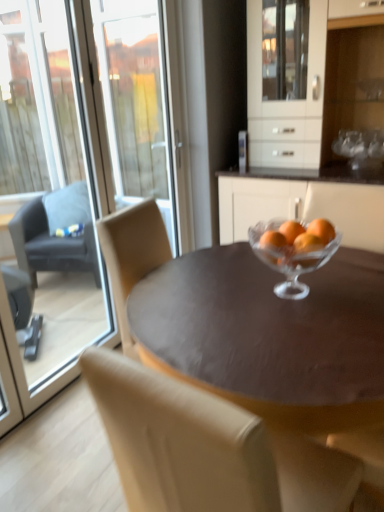
Measure the distance between point (317, 236) and camera.

Point (317, 236) is 1.36 meters from camera.

In order to face matte brown table at center, should I rotate leftwards or rightwards?

To face it directly, rotate right by 10.409 degrees.

Where is `clear glass bowl at center`? The height and width of the screenshot is (512, 384). clear glass bowl at center is located at coordinates (290, 259).

What do you see at coordinates (56, 179) in the screenshot? This screenshot has height=512, width=384. I see `transparent glass screen door at upper left` at bounding box center [56, 179].

Identify the location of orangesmooth glassbowl at center. (322, 230).

Considering the relative positions of orangesmooth glassbowl at center and matte brown table at center in the image provided, is orangesmooth glassbowl at center behind matte brown table at center?

Yes, orangesmooth glassbowl at center is further from the camera.

Which of these two, orangesmooth glassbowl at center or matte brown table at center, is smaller?

With smaller size is orangesmooth glassbowl at center.

Is orangesmooth glassbowl at center taller or shorter than matte brown table at center?

orangesmooth glassbowl at center is shorter than matte brown table at center.

Is beige leather chair at center, the second chair positioned from the top, oriented towards transparent glass screen door at upper left?

No, beige leather chair at center, the second chair positioned from the top, is not oriented towards transparent glass screen door at upper left.

Does beige leather chair at center, arranged as the 1th chair when ordered from the bottom, lie in front of transparent glass screen door at upper left?

Yes, beige leather chair at center, arranged as the 1th chair when ordered from the bottom, is closer to the viewer.

Looking at the image, does matte brown table at center seem bigger or smaller compared to dark gray fabric chair at left, the 2th chair positioned from the front?

In the image, matte brown table at center appears to be larger than dark gray fabric chair at left, the 2th chair positioned from the front.

Between matte brown table at center and dark gray fabric chair at left, which is counted as the 2th chair, starting from the right, which one has smaller width?

With smaller width is dark gray fabric chair at left, which is counted as the 2th chair, starting from the right.

Which is closer, (176, 364) or (62, 262)?

Point (176, 364) appears to be closer to the viewer than point (62, 262).

Could you tell me if matte brown table at center is turned towards dark gray fabric chair at left, which is counted as the 2th chair, starting from the right?

No.

From a real-world perspective, who is located higher, orangesmooth glassbowl at center or dark gray fabric chair at left, which ranks as the 2th chair in bottom-to-top order?

orangesmooth glassbowl at center is physically above.

Is orangesmooth glassbowl at center outside of dark gray fabric chair at left, which is counted as the 2th chair, starting from the right?

orangesmooth glassbowl at center lies outside dark gray fabric chair at left, which is counted as the 2th chair, starting from the right,'s area.

Does orangesmooth glassbowl at center come behind dark gray fabric chair at left, the 1th chair from the top?

No, the depth of orangesmooth glassbowl at center is less than that of dark gray fabric chair at left, the 1th chair from the top.

Could you measure the distance between matte brown table at center and beige leather chair at center, the second chair from the back?

matte brown table at center is 19.53 inches away from beige leather chair at center, the second chair from the back.

Considering the relative sizes of matte brown table at center and beige leather chair at center, marked as the second chair in a left-to-right arrangement, in the image provided, is matte brown table at center shorter than beige leather chair at center, marked as the second chair in a left-to-right arrangement,?

Yes, matte brown table at center is shorter than beige leather chair at center, marked as the second chair in a left-to-right arrangement.

From a real-world perspective, is matte brown table at center on beige leather chair at center, marked as the second chair in a left-to-right arrangement?

No, from a real-world perspective, matte brown table at center is not on top of beige leather chair at center, marked as the second chair in a left-to-right arrangement.

Between matte brown table at center and beige leather chair at center, arranged as the 1th chair when ordered from the bottom, which one appears on the left side from the viewer's perspective?

Positioned to the left is beige leather chair at center, arranged as the 1th chair when ordered from the bottom.

From a real-world perspective, is clear glass bowl at center above or below transparent glass screen door at upper left?

In terms of real-world spatial position, clear glass bowl at center is below transparent glass screen door at upper left.

From the picture: From the image's perspective, is clear glass bowl at center positioned above or below transparent glass screen door at upper left?

Clearly, from the image's perspective, clear glass bowl at center is below transparent glass screen door at upper left.

Is clear glass bowl at center wider than transparent glass screen door at upper left?

Yes, clear glass bowl at center is wider than transparent glass screen door at upper left.

Is clear glass bowl at center thinner than beige leather chair at center, the second chair positioned from the top?

Correct, the width of clear glass bowl at center is less than that of beige leather chair at center, the second chair positioned from the top.

Based on the photo, can you tell me how much clear glass bowl at center and beige leather chair at center, arranged as the 1th chair when ordered from the bottom, differ in facing direction?

There is a 82.8-degree angle between the facing directions of clear glass bowl at center and beige leather chair at center, arranged as the 1th chair when ordered from the bottom.

From the image's perspective, would you say clear glass bowl at center is shown under beige leather chair at center, the 1th chair viewed from the front?

No.

Looking at the image, does clear glass bowl at center seem bigger or smaller compared to beige leather chair at center, the second chair from the back?

clear glass bowl at center is smaller than beige leather chair at center, the second chair from the back.

Locate an element on the screen. The height and width of the screenshot is (512, 384). coffee table that is in front of the orangesmooth glassbowl at center is located at coordinates (270, 335).

Locate an element on the screen. Image resolution: width=384 pixels, height=512 pixels. screen door that is behind the beige leather chair at center, arranged as the 1th chair when ordered from the bottom is located at coordinates (56, 179).

From the image, which object appears to be nearer to matte brown table at center, transparent glass screen door at upper left or orangesmooth glassbowl at center?

orangesmooth glassbowl at center is positioned closer to the anchor matte brown table at center.

Considering their positions, is dark gray fabric chair at left, which appears as the first chair when viewed from the left, positioned further to transparent glass screen door at upper left than white glossy cabinet at upper center?

white glossy cabinet at upper center.

From the image, which object appears to be nearer to dark gray fabric chair at left, which appears as the first chair when viewed from the left, orangesmooth glassbowl at center or matte brown table at center?

matte brown table at center.

Estimate the real-world distances between objects in this image. Which object is further from beige leather chair at center, the 1th chair viewed from the front, dark gray fabric chair at left, the 1th chair from the top, or matte brown table at center?

dark gray fabric chair at left, the 1th chair from the top.

In the scene shown: Which object lies nearer to the anchor point orangesmooth glassbowl at center, matte brown table at center or dark gray fabric chair at left, which is counted as the 2th chair, starting from the right?

matte brown table at center is closer to orangesmooth glassbowl at center.

Estimate the real-world distances between objects in this image. Which object is further from dark gray fabric chair at left, which appears as the first chair when viewed from the left, clear glass bowl at center or orangesmooth glassbowl at center?

The object further to dark gray fabric chair at left, which appears as the first chair when viewed from the left, is orangesmooth glassbowl at center.

Estimate the real-world distances between objects in this image. Which object is further from beige leather chair at center, the second chair from the back, dark gray fabric chair at left, which appears as the first chair when viewed from the left, or clear glass bowl at center?

dark gray fabric chair at left, which appears as the first chair when viewed from the left.

Which object lies nearer to the anchor point dark gray fabric chair at left, which appears as the first chair when viewed from the left, matte brown table at center or beige leather chair at center, the 1th chair viewed from the front?

The object closer to dark gray fabric chair at left, which appears as the first chair when viewed from the left, is matte brown table at center.

This screenshot has width=384, height=512. I want to click on martini glass positioned between transparent glass screen door at upper left and dark gray fabric chair at left, the 1th chair from the top, from near to far, so click(290, 259).

Identify the location of screen door between white glossy cabinet at upper center and beige leather chair at center, the second chair from the back, vertically. Image resolution: width=384 pixels, height=512 pixels. (56, 179).

You are a GUI agent. You are given a task and a screenshot of the screen. Output one action in this format:
    pyautogui.click(x=<x>, y=<y>)
    Task: Click on the coffee table between transparent glass screen door at upper left and orangesmooth glassbowl at center
    This screenshot has height=512, width=384.
    Given the screenshot: What is the action you would take?
    pyautogui.click(x=270, y=335)

The width and height of the screenshot is (384, 512). I want to click on orange between dark gray fabric chair at left, which is counted as the 2th chair, starting from the right, and white glossy cabinet at upper center from left to right, so click(322, 230).